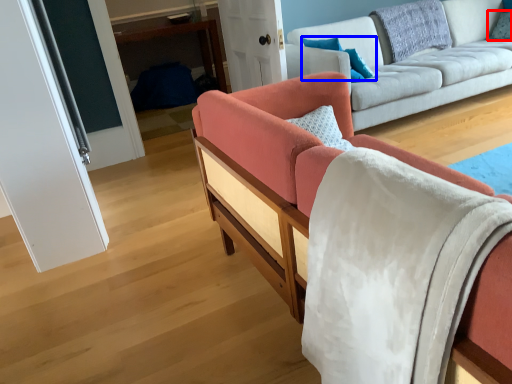
Question: Which point is further to the camera, pillow (highlighted by a red box) or pillow (highlighted by a blue box)?

Choices:
 (A) pillow
 (B) pillow

Answer: (A)